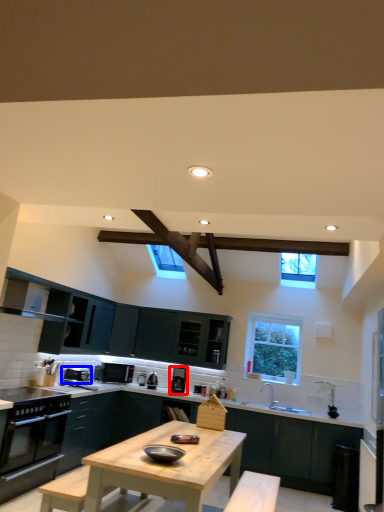
Question: Among these objects, which one is nearest to the camera, appliance (highlighted by a red box) or appliance (highlighted by a blue box)?

Choices:
 (A) appliance
 (B) appliance

Answer: (B)